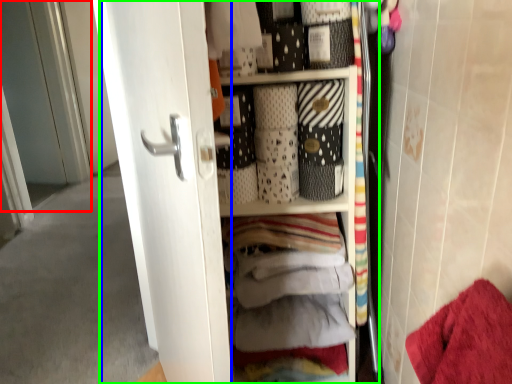
Question: Considering the real-world distances, which object is farthest from screen door (highlighted by a red box)? screen door (highlighted by a blue box) or dresser (highlighted by a green box)?

Choices:
 (A) screen door
 (B) dresser

Answer: (B)